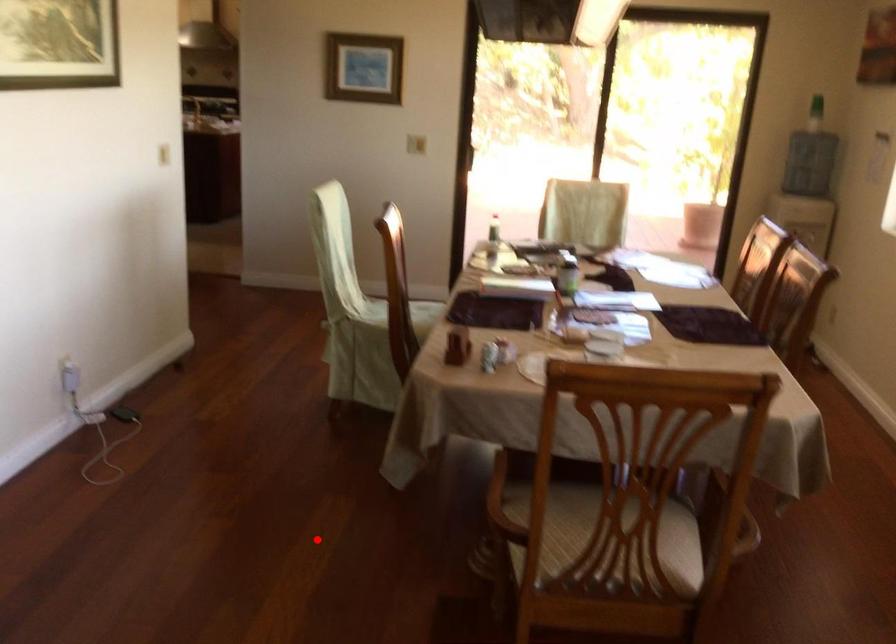
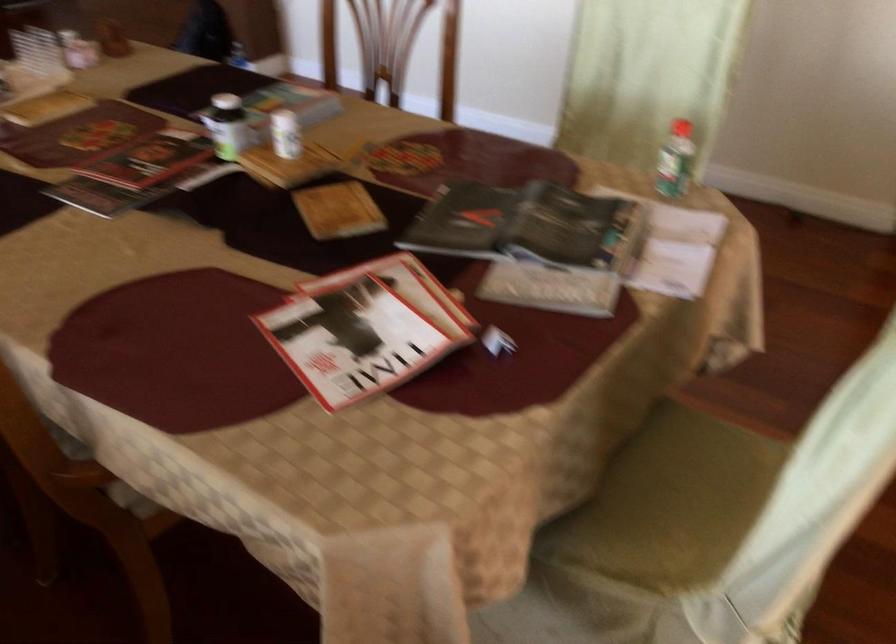
Question: I am providing you with two images of the same scene from different viewpoints. A red point is marked on the first image. Can you still see the location of the red point in image 2?

Choices:
 (A) Yes
 (B) No

Answer: (B)